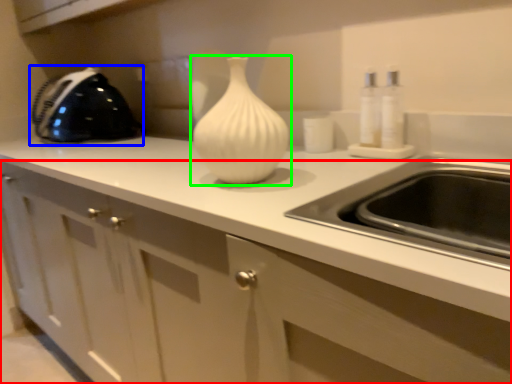
Question: Which object is the farthest from cabinetry (highlighted by a red box)? Choose among these: appliance (highlighted by a blue box) or vase (highlighted by a green box).

Choices:
 (A) appliance
 (B) vase

Answer: (A)